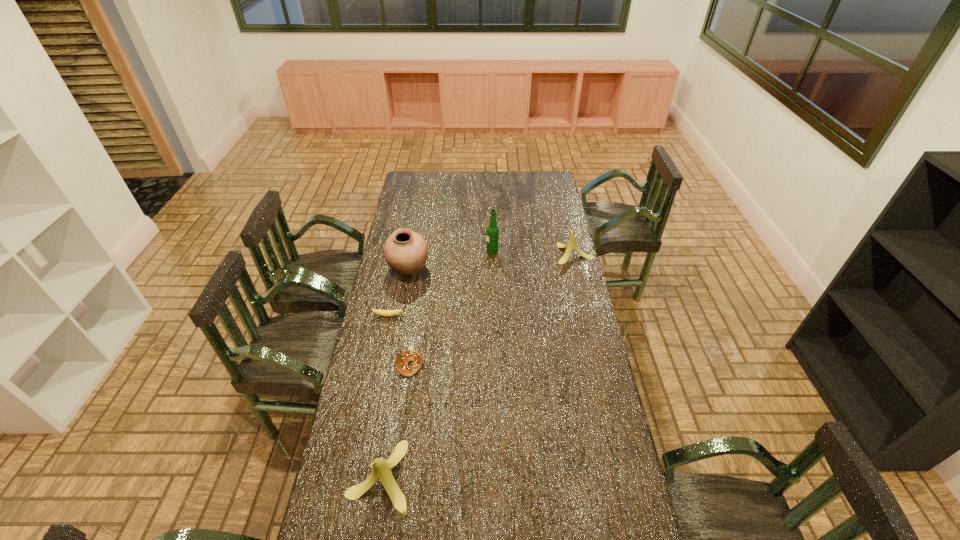
Image resolution: width=960 pixels, height=540 pixels. Identify the location of free spot that satisfies the following two spatial constraints: 1. on the front side of the fifth farthest object; 2. on the left side of the second nearest banana. (378, 365).

At what (x,y) coordinates should I click in order to perform the action: click on blank area in the image that satisfies the following two spatial constraints: 1. on the label of the fifth object from left to right; 2. on the front side of the pottery. Please return your answer as a coordinate pair (x, y). The image size is (960, 540). Looking at the image, I should click on (492, 268).

At what (x,y) coordinates should I click in order to perform the action: click on free space in the image that satisfies the following two spatial constraints: 1. on the label of the second object from right to left; 2. on the front side of the second nearest object. Please return your answer as a coordinate pair (x, y). Looking at the image, I should click on (496, 365).

You are a GUI agent. You are given a task and a screenshot of the screen. Output one action in this format:
    pyautogui.click(x=<x>, y=<y>)
    Task: Click on the vacant area in the image that satisfies the following two spatial constraints: 1. on the label of the fifth object from left to right; 2. on the left side of the second tallest banana
    
    Given the screenshot: What is the action you would take?
    pyautogui.click(x=492, y=254)

Locate an element on the screen. The width and height of the screenshot is (960, 540). vacant space that satisfies the following two spatial constraints: 1. on the back side of the rightmost banana; 2. on the right side of the fourth farthest object is located at coordinates (401, 254).